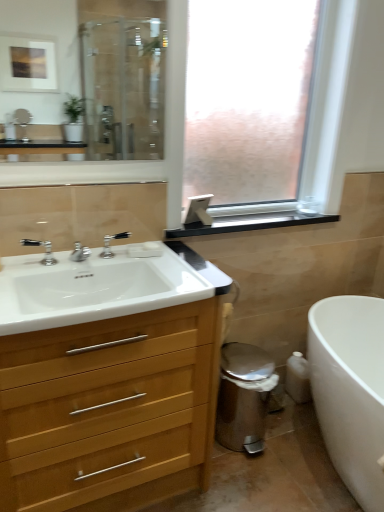
Question: Is clear glass mirror at upper left facing away from white glossy bathtub at lower right?

Choices:
 (A) yes
 (B) no

Answer: (B)

Question: Is clear glass mirror at upper left outside of white glossy bathtub at lower right?

Choices:
 (A) no
 (B) yes

Answer: (B)

Question: Is the position of clear glass mirror at upper left less distant than that of white glossy bathtub at lower right?

Choices:
 (A) yes
 (B) no

Answer: (A)

Question: Can you confirm if clear glass mirror at upper left is bigger than white glossy bathtub at lower right?

Choices:
 (A) yes
 (B) no

Answer: (B)

Question: Can you confirm if clear glass mirror at upper left is positioned to the right of white glossy bathtub at lower right?

Choices:
 (A) yes
 (B) no

Answer: (B)

Question: Is point (34, 273) closer or farther from the camera than point (124, 237)?

Choices:
 (A) farther
 (B) closer

Answer: (B)

Question: Would you say white glossy sink at left is inside or outside polished chrome faucet at center, the first tap when ordered from back to front?

Choices:
 (A) outside
 (B) inside

Answer: (A)

Question: From a real-world perspective, relative to polished chrome faucet at center, which is the 2th tap in front-to-back order, is white glossy sink at left vertically above or below?

Choices:
 (A) below
 (B) above

Answer: (A)

Question: Is white glossy sink at left to the left or to the right of polished chrome faucet at center, which is the 2th tap in front-to-back order, in the image?

Choices:
 (A) left
 (B) right

Answer: (A)

Question: Is point (23, 504) positioned closer to the camera than point (157, 244)?

Choices:
 (A) closer
 (B) farther

Answer: (A)

Question: From the image's perspective, is white wood cabinet at left positioned above or below white matte soap at center?

Choices:
 (A) above
 (B) below

Answer: (B)

Question: Considering the positions of white wood cabinet at left and white matte soap at center in the image, is white wood cabinet at left taller or shorter than white matte soap at center?

Choices:
 (A) short
 (B) tall

Answer: (B)

Question: Based on their sizes in the image, would you say white wood cabinet at left is bigger or smaller than white matte soap at center?

Choices:
 (A) big
 (B) small

Answer: (A)

Question: From a real-world perspective, relative to frosted glass window at center, is white wood cabinet at left vertically above or below?

Choices:
 (A) above
 (B) below

Answer: (B)

Question: Is white wood cabinet at left in front of or behind frosted glass window at center in the image?

Choices:
 (A) front
 (B) behind

Answer: (A)